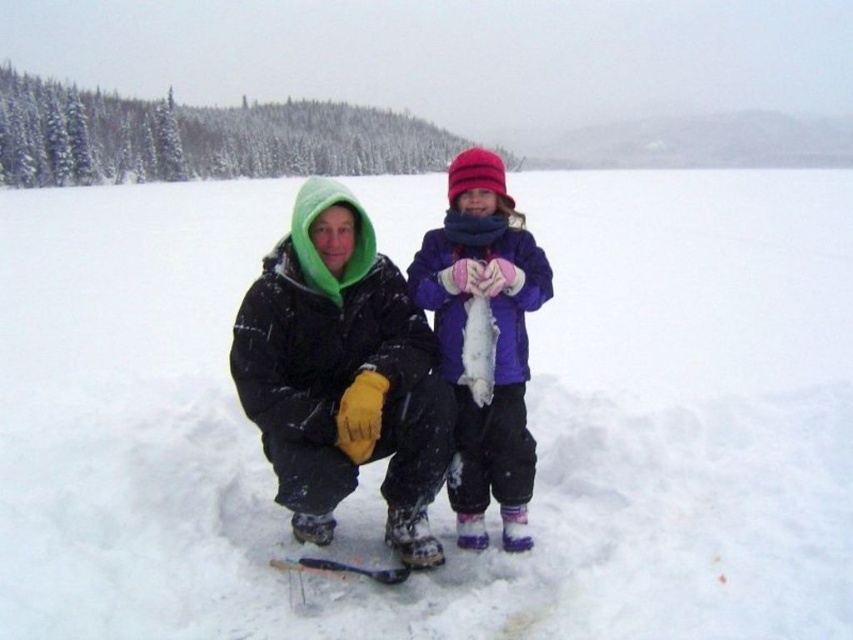
Looking at this image, you are standing at the point labeled as point (442, 492) in the image. What do you see directly below you?

You are standing on white fluffy snow at center, which is located at point (442, 492).

You are standing in the snowy landscape and want to take a photo of both the adult and the child. Which of the two points, point (805, 397) or point (463, 220), should you focus on to ensure both are in clear view?

You should focus on point (463, 220) because it is closer to the camera than point (805, 397). By focusing on the closer point, both the adult and child will be in clear view as the depth of field will cover the distance between them.